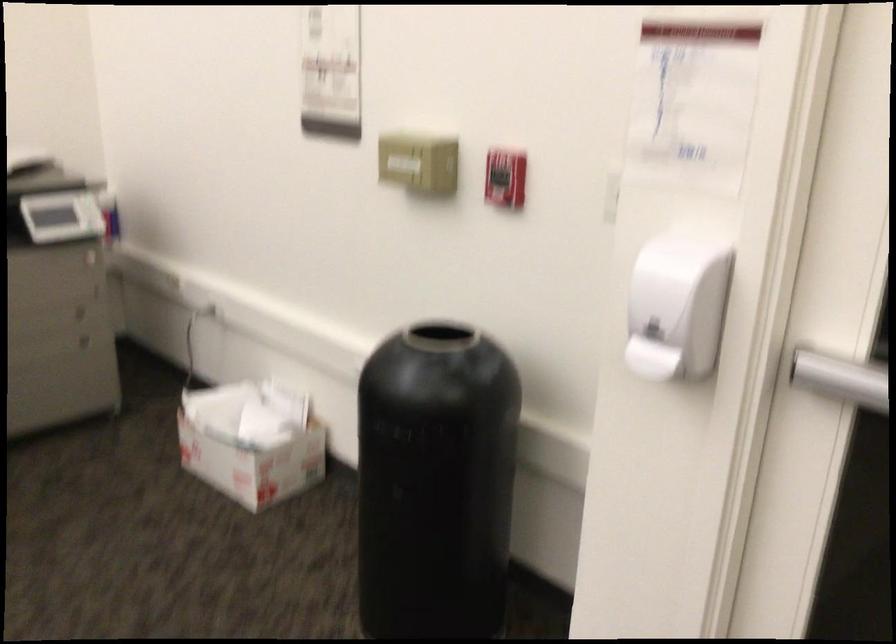
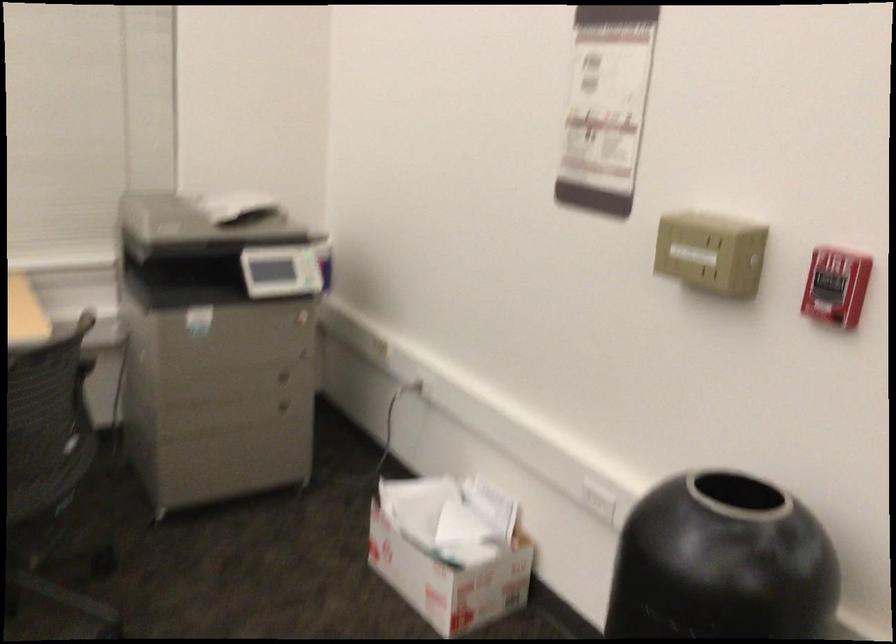
Question: How did the camera likely rotate?

Choices:
 (A) Left
 (B) Right
 (C) Up
 (D) Down

Answer: (A)